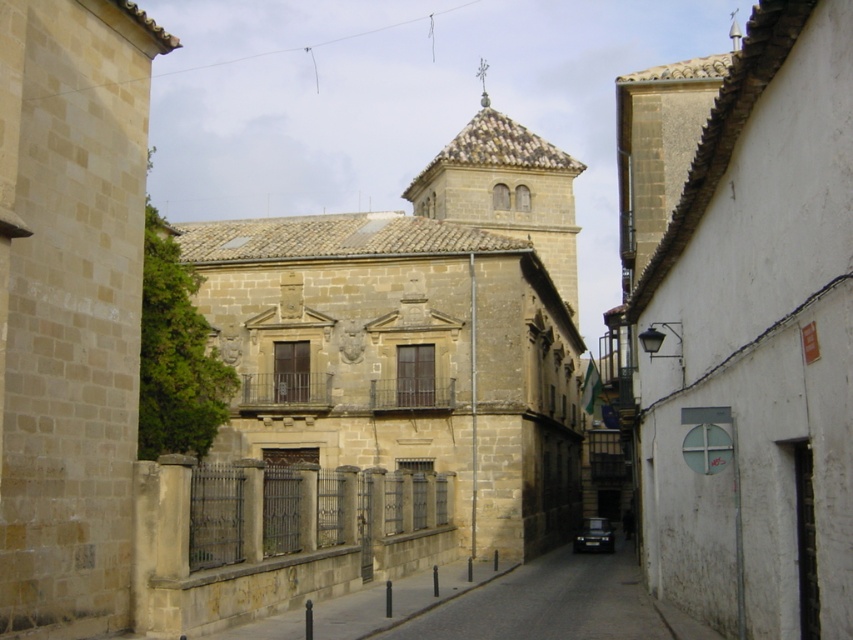
In the scene shown: Does stone church at center have a lesser width compared to white stucco church at center?

No.

Between point (379, 390) and point (669, 524), which one is positioned behind?

The point (379, 390) is behind.

Describe the element at coordinates (376, 390) in the screenshot. I see `stone church at center` at that location.

This screenshot has height=640, width=853. Find the location of `stone church at center`. stone church at center is located at coordinates (376, 390).

Is the position of white stucco church at center more distant than that of black glossy car at center?

That is False.

Image resolution: width=853 pixels, height=640 pixels. Find the location of `white stucco church at center`. white stucco church at center is located at coordinates (743, 323).

You are a GUI agent. You are given a task and a screenshot of the screen. Output one action in this format:
    pyautogui.click(x=<x>, y=<y>)
    Task: Click on the white stucco church at center
    Image resolution: width=853 pixels, height=640 pixels.
    Given the screenshot: What is the action you would take?
    pyautogui.click(x=743, y=323)

Who is positioned more to the right, stone church at center or brown stone tower at center?

brown stone tower at center

Is point (527, 516) in front of point (548, 168)?

Yes, point (527, 516) is closer to viewer.

Is point (180, 230) in front of point (473, 120)?

Yes, it is.

Locate an element on the screen. This screenshot has width=853, height=640. stone church at center is located at coordinates (376, 390).